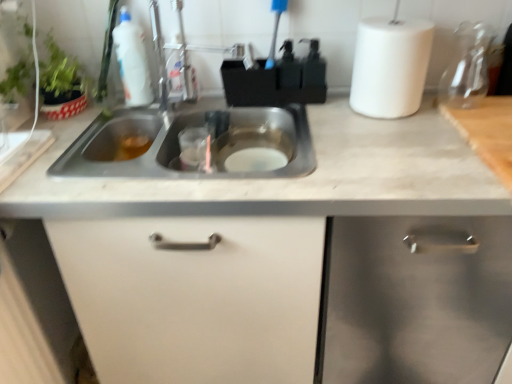
Question: Is stainless steel sink at center completely or partially inside white matte cabinet at center, marked as the 2th cabinetry in a right-to-left arrangement?

Choices:
 (A) no
 (B) yes

Answer: (B)

Question: Is white matte cabinet at center, placed as the 1th cabinetry when sorted from left to right, facing away from stainless steel sink at center?

Choices:
 (A) no
 (B) yes

Answer: (A)

Question: From the image's perspective, is white matte cabinet at center, marked as the 2th cabinetry in a right-to-left arrangement, located beneath stainless steel sink at center?

Choices:
 (A) no
 (B) yes

Answer: (B)

Question: Is white matte cabinet at center, placed as the 1th cabinetry when sorted from left to right, thinner than stainless steel sink at center?

Choices:
 (A) no
 (B) yes

Answer: (A)

Question: Could you tell me if white matte cabinet at center, marked as the 2th cabinetry in a right-to-left arrangement, is turned towards stainless steel sink at center?

Choices:
 (A) no
 (B) yes

Answer: (A)

Question: Does white matte cabinet at center, marked as the 2th cabinetry in a right-to-left arrangement, have a larger size compared to stainless steel sink at center?

Choices:
 (A) no
 (B) yes

Answer: (B)

Question: Does white matte paper towel at upper right contain white matte cabinet at center, placed as the 1th cabinetry when sorted from left to right?

Choices:
 (A) yes
 (B) no

Answer: (B)

Question: Is white matte paper towel at upper right positioned behind white matte cabinet at center, placed as the 1th cabinetry when sorted from left to right?

Choices:
 (A) no
 (B) yes

Answer: (B)

Question: Is white matte paper towel at upper right aimed at white matte cabinet at center, placed as the 1th cabinetry when sorted from left to right?

Choices:
 (A) yes
 (B) no

Answer: (B)

Question: Considering the relative sizes of white matte paper towel at upper right and white matte cabinet at center, marked as the 2th cabinetry in a right-to-left arrangement, in the image provided, is white matte paper towel at upper right bigger than white matte cabinet at center, marked as the 2th cabinetry in a right-to-left arrangement,?

Choices:
 (A) yes
 (B) no

Answer: (B)

Question: Can you confirm if white matte paper towel at upper right is thinner than white matte cabinet at center, placed as the 1th cabinetry when sorted from left to right?

Choices:
 (A) no
 (B) yes

Answer: (B)

Question: From a real-world perspective, is white matte paper towel at upper right below white matte cabinet at center, placed as the 1th cabinetry when sorted from left to right?

Choices:
 (A) no
 (B) yes

Answer: (A)

Question: Is white matte cabinet at center, marked as the 2th cabinetry in a right-to-left arrangement, thinner than white matte cabinet at right, which is the 1th cabinetry in right-to-left order?

Choices:
 (A) yes
 (B) no

Answer: (A)